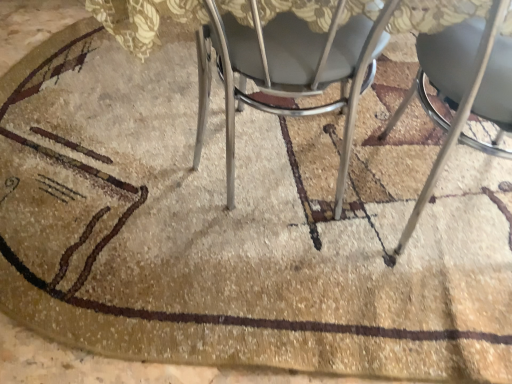
Question: Is metallic silver chair at lower right, placed as the first chair when sorted from right to left, inside or outside of metallic silver chair at center, placed as the first chair when sorted from left to right?

Choices:
 (A) inside
 (B) outside

Answer: (B)

Question: Is metallic silver chair at lower right, placed as the first chair when sorted from right to left, bigger or smaller than metallic silver chair at center, the second chair from the right?

Choices:
 (A) small
 (B) big

Answer: (A)

Question: From a real-world perspective, is metallic silver chair at lower right, acting as the 2th chair starting from the left, above or below metallic silver chair at center, the second chair from the right?

Choices:
 (A) below
 (B) above

Answer: (B)

Question: Visually, is metallic silver chair at center, the second chair from the right, positioned to the left or to the right of metallic silver chair at lower right, acting as the 2th chair starting from the left?

Choices:
 (A) left
 (B) right

Answer: (A)

Question: From their relative heights in the image, would you say metallic silver chair at center, the second chair from the right, is taller or shorter than metallic silver chair at lower right, acting as the 2th chair starting from the left?

Choices:
 (A) tall
 (B) short

Answer: (B)

Question: Considering their positions, is metallic silver chair at center, placed as the first chair when sorted from left to right, located in front of or behind metallic silver chair at lower right, placed as the first chair when sorted from right to left?

Choices:
 (A) behind
 (B) front

Answer: (A)

Question: From the image's perspective, is metallic silver chair at center, the second chair from the right, located above or below metallic silver chair at lower right, acting as the 2th chair starting from the left?

Choices:
 (A) above
 (B) below

Answer: (A)